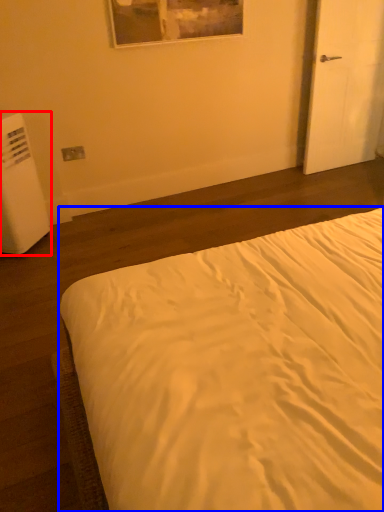
Question: Which object appears farthest to the camera in this image, water heater (highlighted by a red box) or bed (highlighted by a blue box)?

Choices:
 (A) water heater
 (B) bed

Answer: (A)